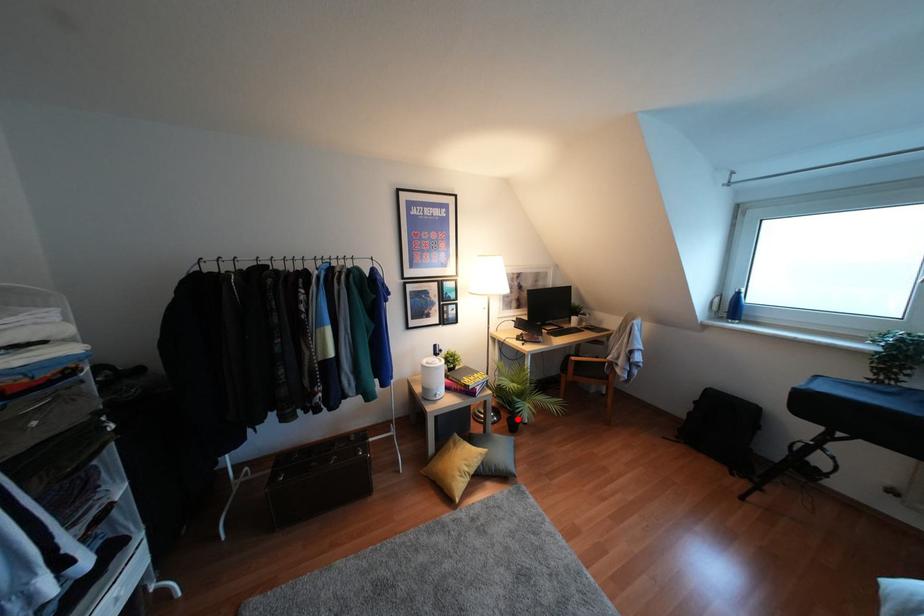
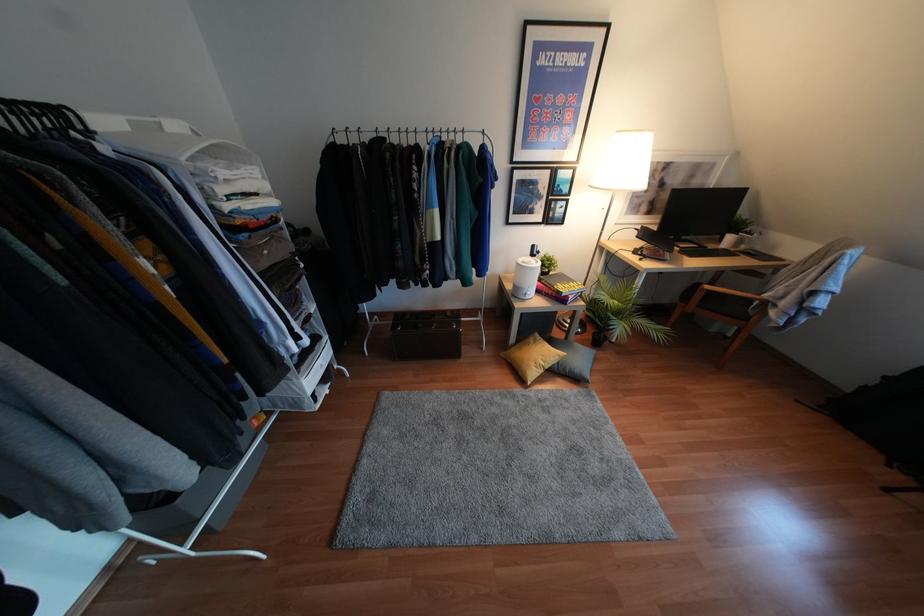
Question: A red point is marked in image1. In image2, is the corresponding 3D point closer to the camera or farther? Reply with the corresponding letter.

Choices:
 (A) The corresponding 3D point is closer.
 (B) The corresponding 3D point is farther.

Answer: (A)